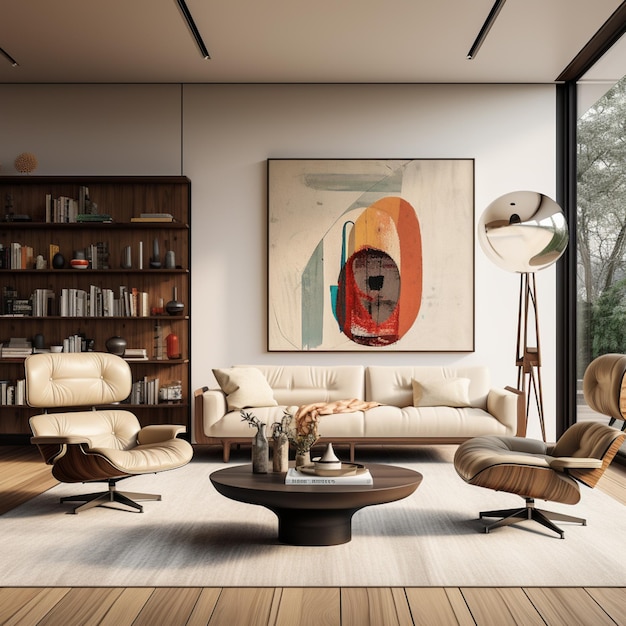
Where is `chair`? Image resolution: width=626 pixels, height=626 pixels. chair is located at coordinates (106, 453), (515, 453).